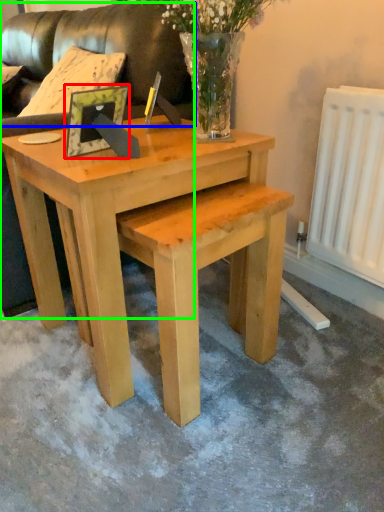
Question: Which object is the closest to the picture frame (highlighted by a red box)? Choose among these: couch (highlighted by a blue box) or couch (highlighted by a green box).

Choices:
 (A) couch
 (B) couch

Answer: (B)